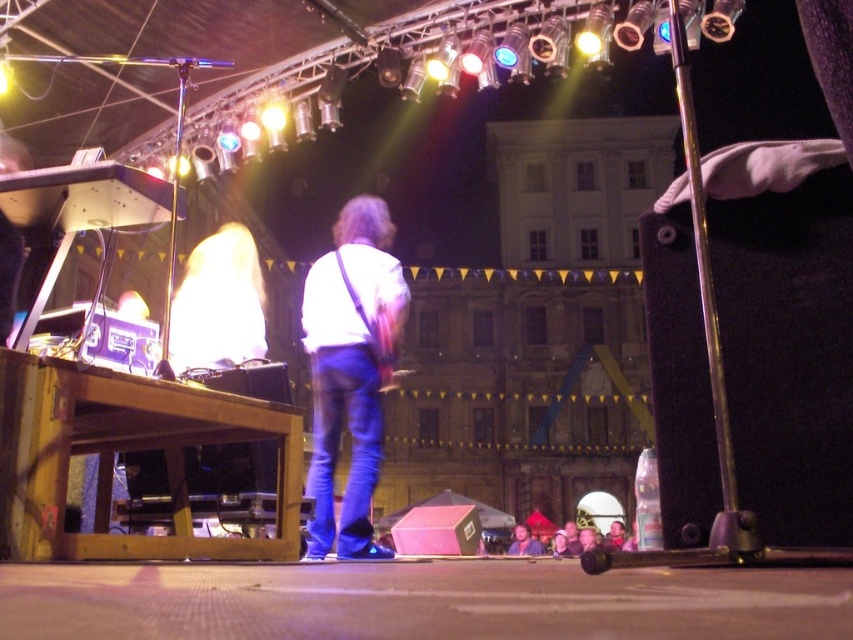
Question: Which point is farther from the camera taking this photo?

Choices:
 (A) (579, 547)
 (B) (521, 545)
 (C) (323, 518)
 (D) (618, 531)

Answer: (D)

Question: Considering the real-world distances, which object is farthest from the smooth skin face at center?

Choices:
 (A) smooth brown leather jacket at center
 (B) smooth pink fabric at lower center
 (C) white matte shirt at center
 (D) smooth skin face at lower center

Answer: (C)

Question: Which is nearer to the smooth brown leather jacket at center?

Choices:
 (A) white matte shirt at center
 (B) smooth skin face at center
 (C) smooth skin face at lower center
 (D) smooth pink fabric at lower center

Answer: (D)

Question: Is smooth skin face at lower center wider than smooth skin face at center?

Choices:
 (A) yes
 (B) no

Answer: (A)

Question: Can you confirm if white matte shirt at center is positioned to the right of smooth skin face at lower center?

Choices:
 (A) no
 (B) yes

Answer: (A)

Question: Is white matte shirt at center to the left of smooth skin face at lower center from the viewer's perspective?

Choices:
 (A) yes
 (B) no

Answer: (A)